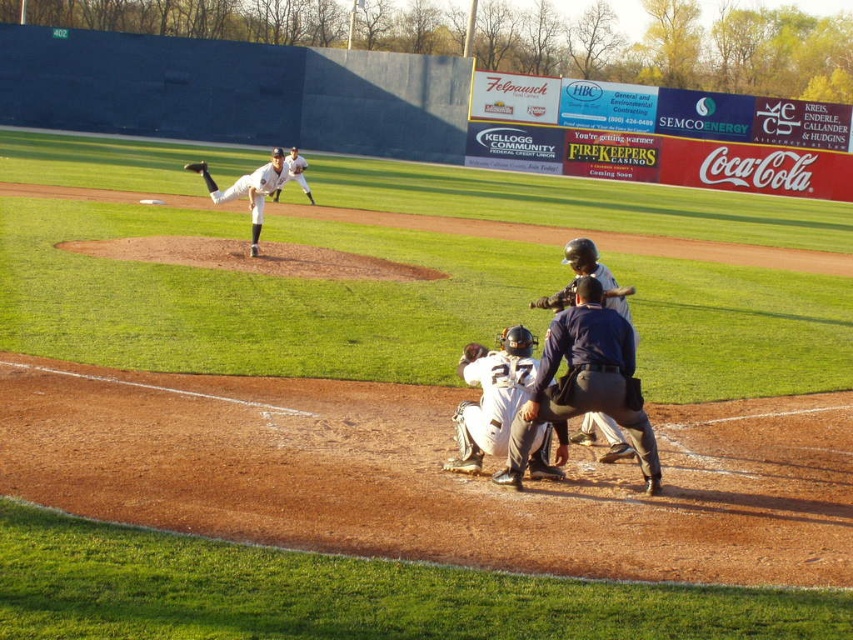
You are a baseball player who just hit the ball and are running towards first base. You see the wooden bat at lower center and the brown leather glove at upper center. Which object is closer to you?

The wooden bat at lower center is closer to you since it is at lower center compared to the brown leather glove at upper center, which is further away.

You are a baseball player standing at home plate. You need to quickly retrieve a ball that rolled between the white matte uniform at lower center and the matte blue umpire at center. Considering the distance between them, can you reach the ball without moving more than 1 meter from your current position?

The distance between the white matte uniform at lower center and the matte blue umpire at center is 86.28 centimeters. Since 86.28 cm is less than 1 meter, you can reach the ball without moving more than 1 meter from your current position.